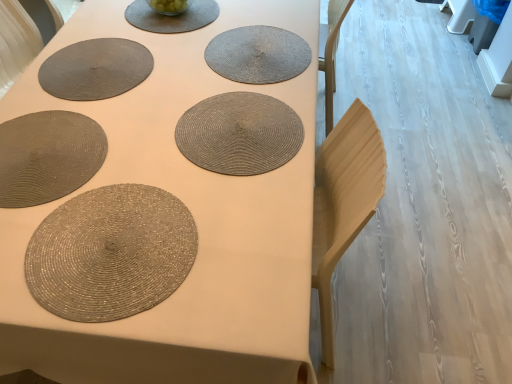
Find the location of a particular element. The width and height of the screenshot is (512, 384). free region under rattan placemat at center, which appears as the first coaster when viewed from the back (from a real-world perspective) is located at coordinates (251, 50).